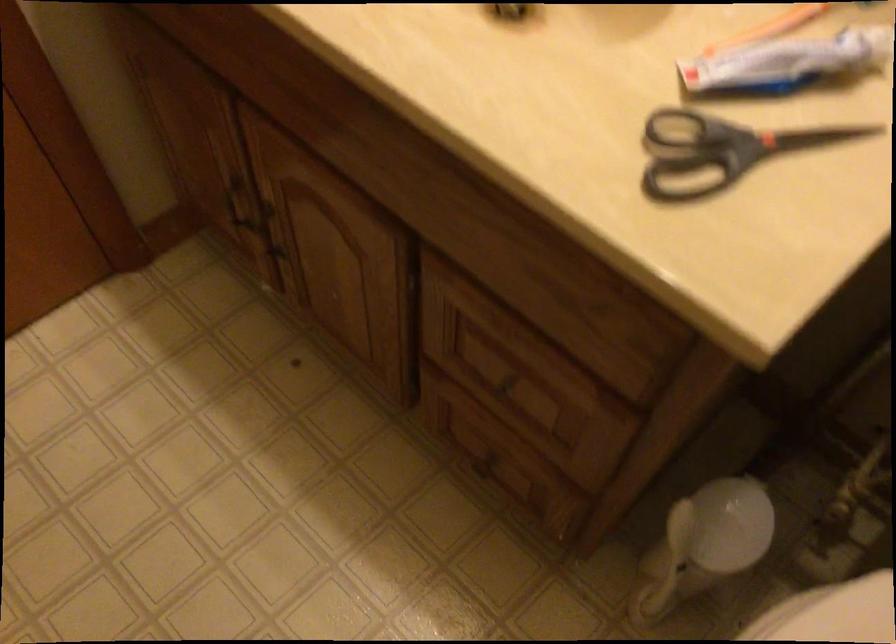
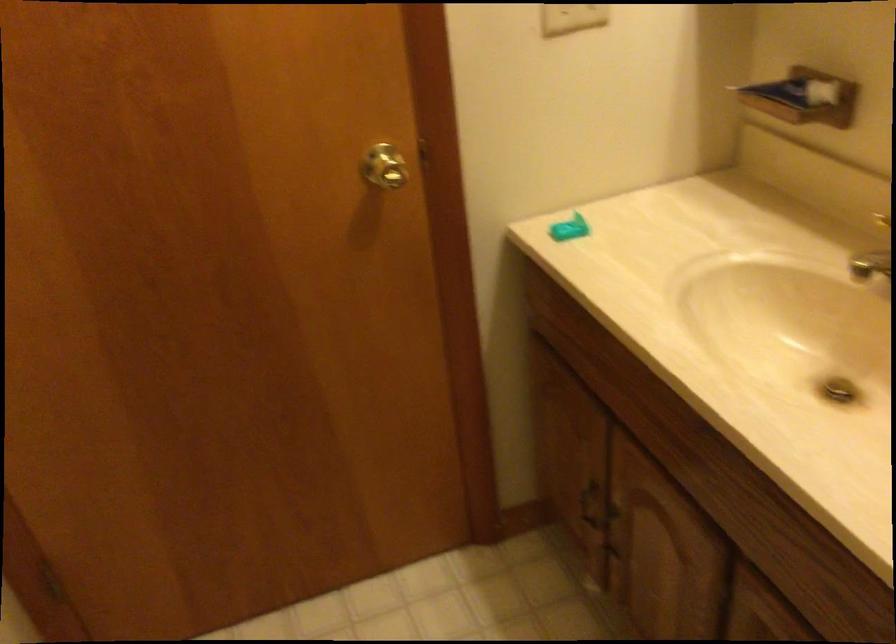
How did the camera likely rotate?

The camera rotated toward left-up.